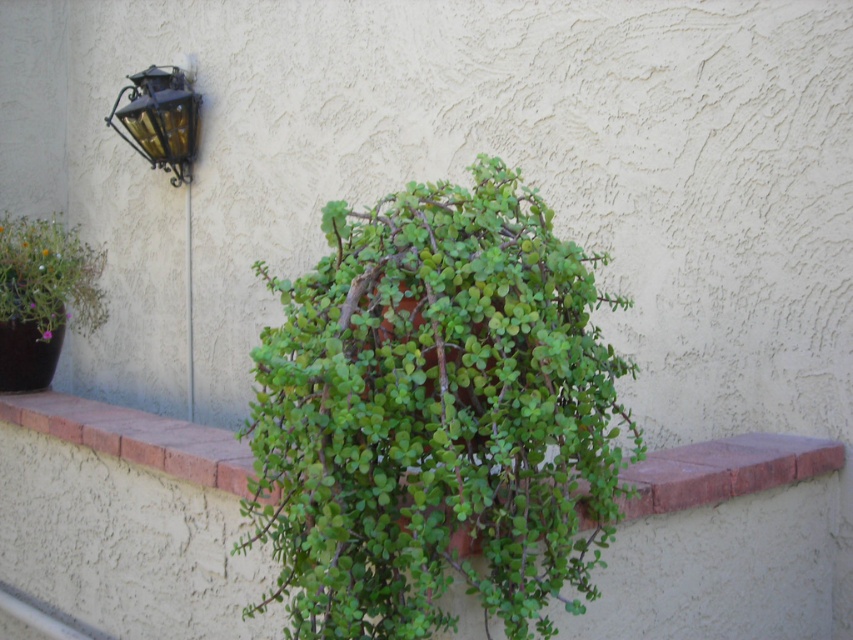
You are standing in front of the wall with the textured stucco finish. You see a green matte plant at center and a decorative wall mounted lantern with dark metal frame and glass panel on the left side. Which object is closer to the center of the wall?

The green matte plant at center is located at point (434,417), which is closer to the center of the wall compared to the decorative wall mounted lantern with dark metal frame and glass panel on the left side.

You are standing in front of the wall with the stucco finish. There are two points marked on the wall at coordinates point (395, 522) and point (80, 282). Which of these points is closer to you?

Point (395, 522) is closer to the viewer than point (80, 282).

You are an interior designer assessing the wall decor. You need to know which object is taller between the matte purple flower pot at left and the gold textured lantern at upper left. Can you determine this?

The matte purple flower pot at left is taller than the gold textured lantern at upper left according to the description.